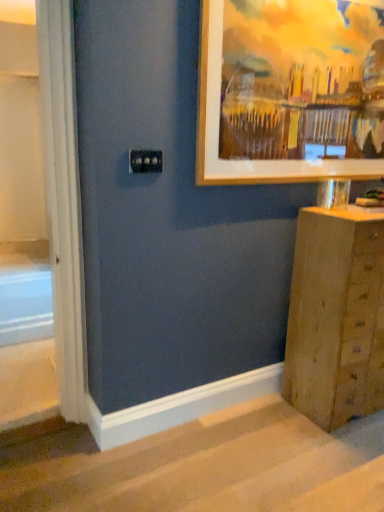
Question: From the image's perspective, would you say wooden frame at upper right is positioned over carpeted stairs at lower center?

Choices:
 (A) no
 (B) yes

Answer: (B)

Question: Would you say wooden frame at upper right is outside carpeted stairs at lower center?

Choices:
 (A) no
 (B) yes

Answer: (B)

Question: Considering the relative positions of wooden frame at upper right and carpeted stairs at lower center in the image provided, is wooden frame at upper right in front of carpeted stairs at lower center?

Choices:
 (A) yes
 (B) no

Answer: (B)

Question: Is wooden frame at upper right shorter than carpeted stairs at lower center?

Choices:
 (A) yes
 (B) no

Answer: (B)

Question: From a real-world perspective, is wooden frame at upper right below carpeted stairs at lower center?

Choices:
 (A) no
 (B) yes

Answer: (A)

Question: Can you confirm if wooden frame at upper right is thinner than carpeted stairs at lower center?

Choices:
 (A) no
 (B) yes

Answer: (B)

Question: Can you confirm if carpeted stairs at lower center is wider than wooden frame at upper right?

Choices:
 (A) yes
 (B) no

Answer: (A)

Question: Can we say carpeted stairs at lower center lies outside wooden frame at upper right?

Choices:
 (A) yes
 (B) no

Answer: (A)

Question: Is wooden frame at upper right surrounded by carpeted stairs at lower center?

Choices:
 (A) yes
 (B) no

Answer: (B)

Question: Does carpeted stairs at lower center have a lesser height compared to wooden frame at upper right?

Choices:
 (A) no
 (B) yes

Answer: (B)

Question: Does carpeted stairs at lower center have a greater height compared to wooden frame at upper right?

Choices:
 (A) yes
 (B) no

Answer: (B)

Question: From the image's perspective, is carpeted stairs at lower center above wooden frame at upper right?

Choices:
 (A) no
 (B) yes

Answer: (A)

Question: From the image's perspective, would you say wooden chest of drawers at lower right is positioned over wooden frame at upper right?

Choices:
 (A) yes
 (B) no

Answer: (B)